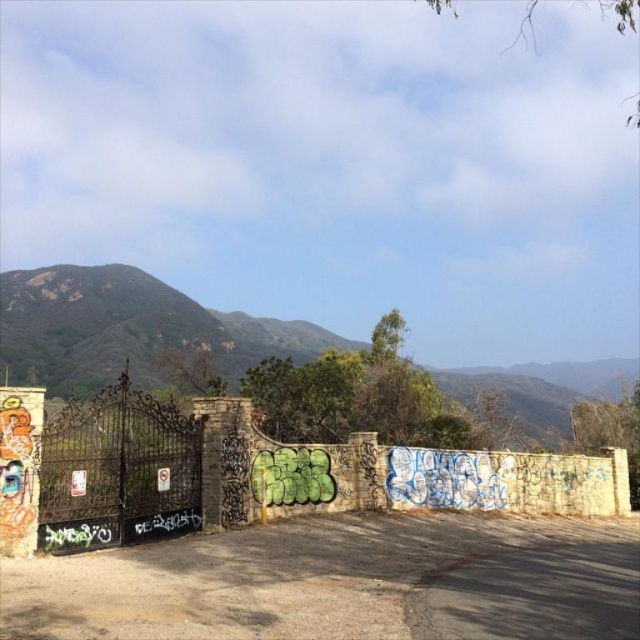
Does point (522, 502) come farther from viewer compared to point (65, 504)?

Yes, point (522, 502) is behind point (65, 504).

The image size is (640, 640). In order to click on stone textured wall at center in this screenshot , I will do `click(275, 474)`.